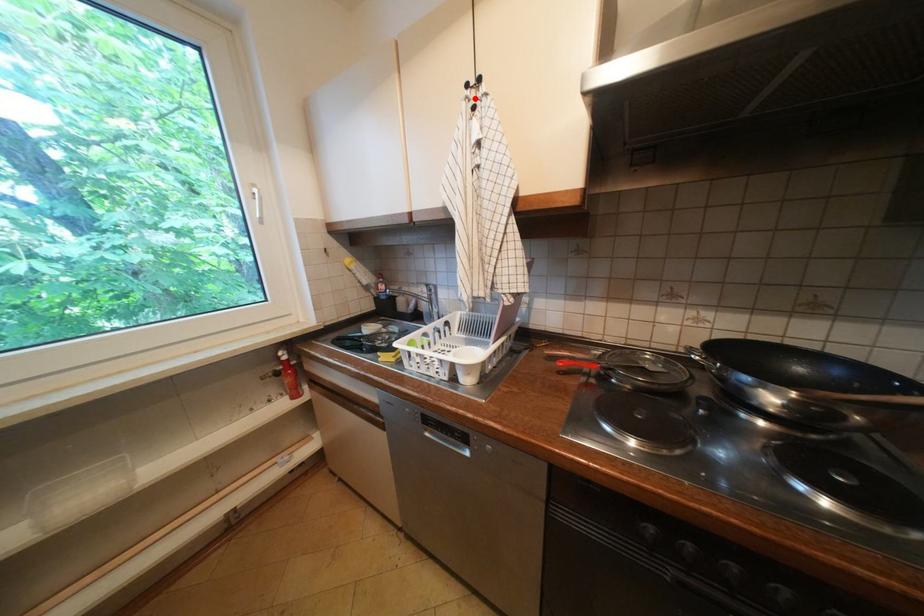
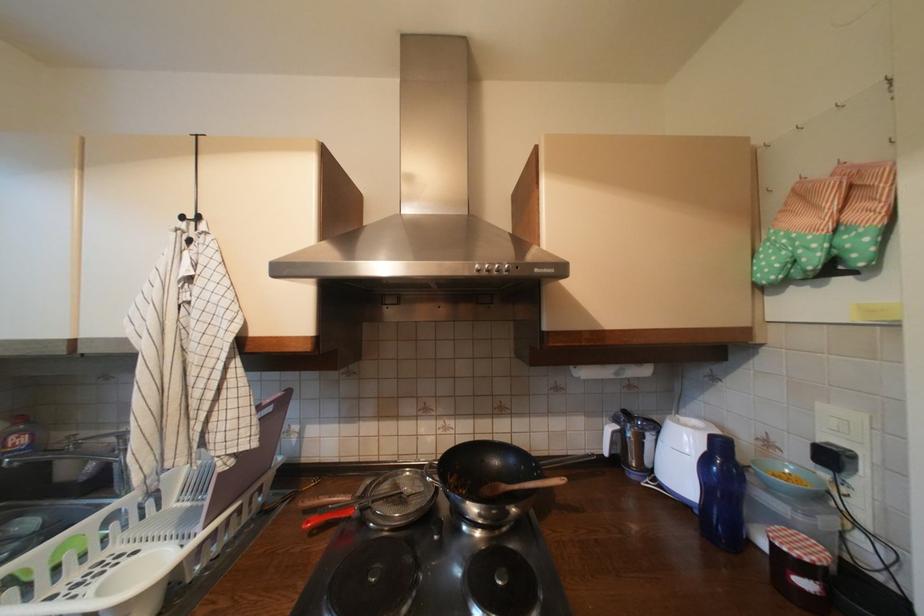
Find the pixel in the second image that matches the highlighted location in the first image.

(187, 230)